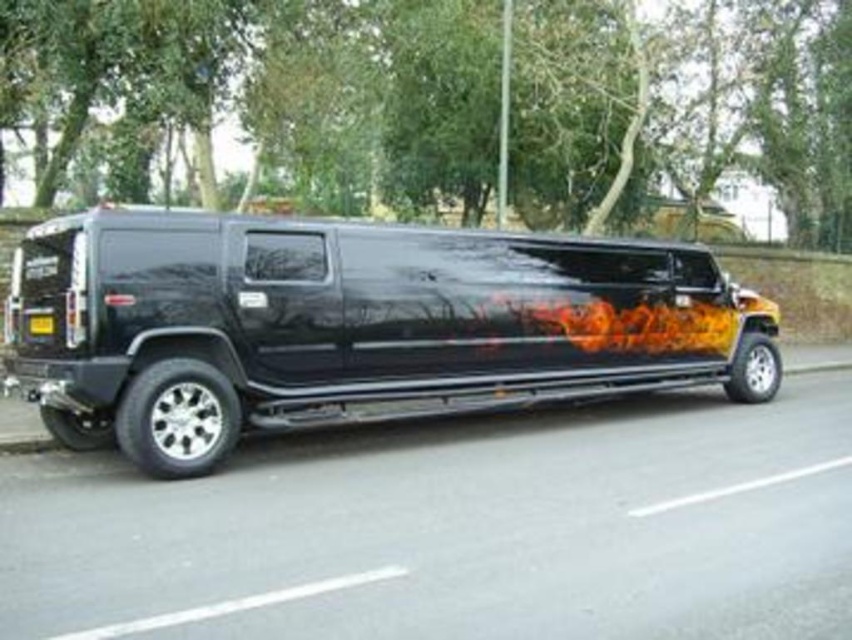
Looking at this image, which is more to the right, glossy black limousine at center or yellow matte license plate at rear?

glossy black limousine at center

Does glossy black limousine at center appear under yellow matte license plate at rear?

Yes, glossy black limousine at center is below yellow matte license plate at rear.

Who is more distant from viewer, (349, 314) or (49, 314)?

The point (349, 314) is more distant.

At what (x,y) coordinates should I click in order to perform the action: click on glossy black limousine at center. Please return your answer as a coordinate pair (x, y). Looking at the image, I should click on (352, 324).